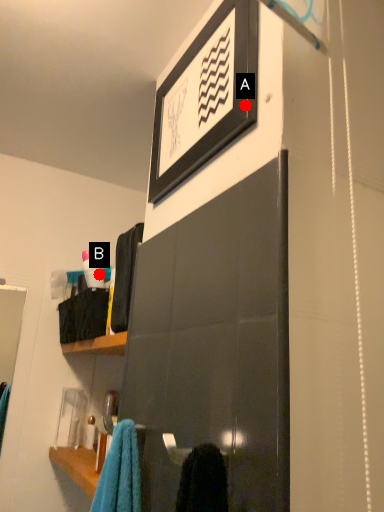
Question: Two points are circled on the image, labeled by A and B beside each circle. Among these points, which one is farthest from the camera?

Choices:
 (A) A is further
 (B) B is further

Answer: (B)